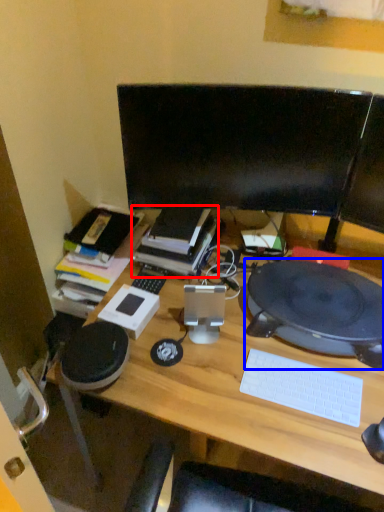
Question: Which point is closer to the camera, book (highlighted by a red box) or computer (highlighted by a blue box)?

Choices:
 (A) book
 (B) computer

Answer: (B)